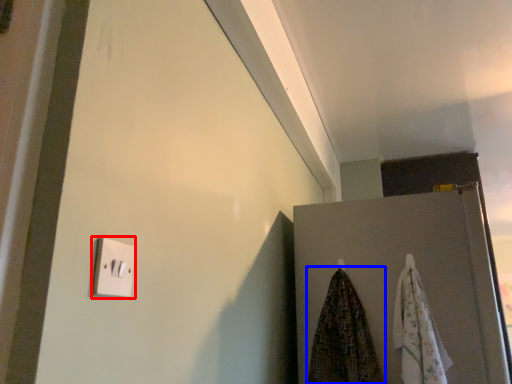
Question: Which object appears farthest to the camera in this image, light switch (highlighted by a red box) or beach towel (highlighted by a blue box)?

Choices:
 (A) light switch
 (B) beach towel

Answer: (B)